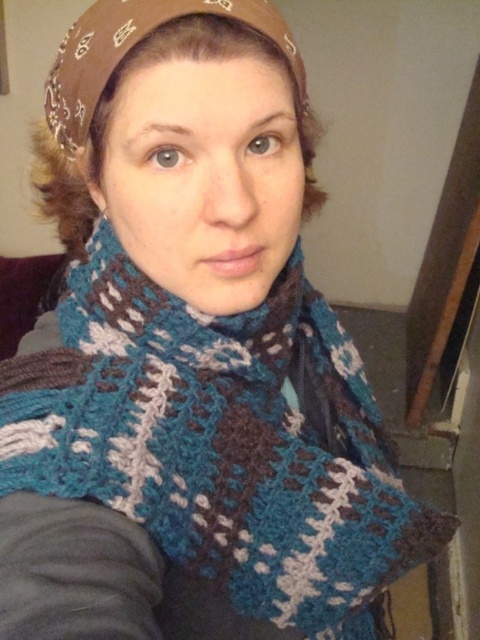
Question: Observing the image, what is the correct spatial positioning of crochetmaterial/texturescarf at center in reference to brown bandana at upper center?

Choices:
 (A) right
 (B) left

Answer: (A)

Question: Among these points, which one is nearest to the camera?

Choices:
 (A) (144, 8)
 (B) (39, 385)

Answer: (A)

Question: Can you confirm if crochetmaterial/texturescarf at center is smaller than brown bandana at upper center?

Choices:
 (A) yes
 (B) no

Answer: (B)

Question: Which object is farther from the camera taking this photo?

Choices:
 (A) crochetmaterial/texturescarf at center
 (B) brown bandana at upper center

Answer: (A)

Question: Is the position of crochetmaterial/texturescarf at center more distant than that of brown bandana at upper center?

Choices:
 (A) yes
 (B) no

Answer: (A)